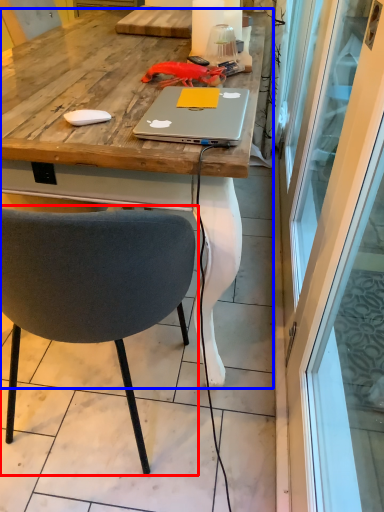
Question: Which of the following is the closest to the observer, chair (highlighted by a red box) or desk (highlighted by a blue box)?

Choices:
 (A) chair
 (B) desk

Answer: (A)